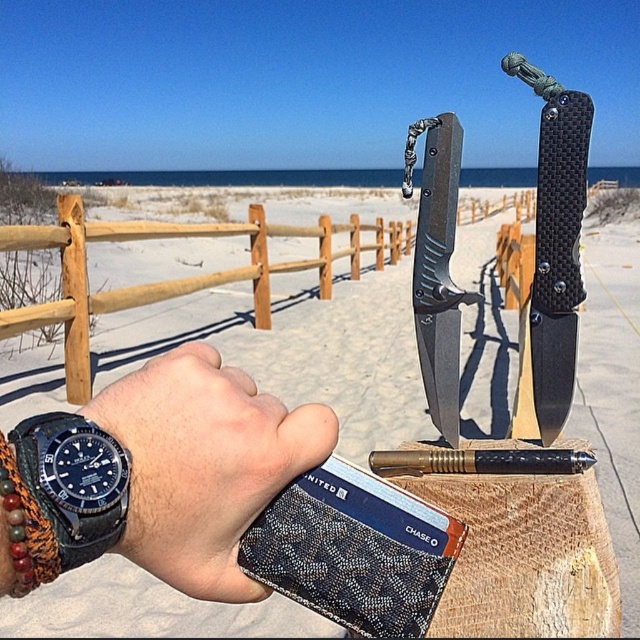
Question: Is matte black knife at center to the left of multicolored beaded bracelet at wrist from the viewer's perspective?

Choices:
 (A) no
 (B) yes

Answer: (A)

Question: Which object is positioned farthest from the matte black knife at center?

Choices:
 (A) black carbon fiber knife at center
 (B) black textured knife at upper center
 (C) multicolored beaded bracelet at wrist
 (D) black leather watch at lower left

Answer: (B)

Question: Which is farther from the black leather watch at lower left?

Choices:
 (A) black carbon fiber knife at center
 (B) matte black knife at center

Answer: (A)

Question: Can you confirm if black carbon fiber knife at center is wider than matte black knife at center?

Choices:
 (A) no
 (B) yes

Answer: (B)

Question: Which object is closer to the camera taking this photo?

Choices:
 (A) multicolored beaded bracelet at wrist
 (B) black leather watch at lower left

Answer: (A)

Question: Can you confirm if matte black knife at center is wider than multicolored beaded bracelet at wrist?

Choices:
 (A) yes
 (B) no

Answer: (A)